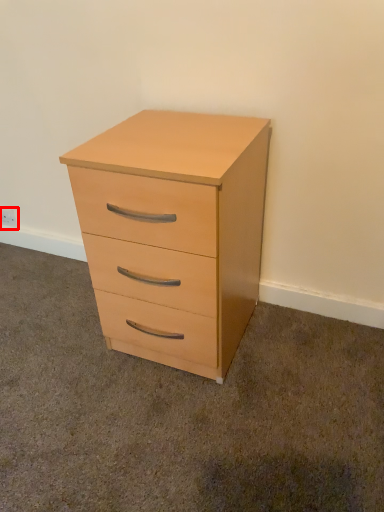
Question: From the image's perspective, considering the relative positions of electric outlet (annotated by the red box) and chest of drawers in the image provided, where is electric outlet (annotated by the red box) located with respect to the staircase?

Choices:
 (A) below
 (B) above

Answer: (B)